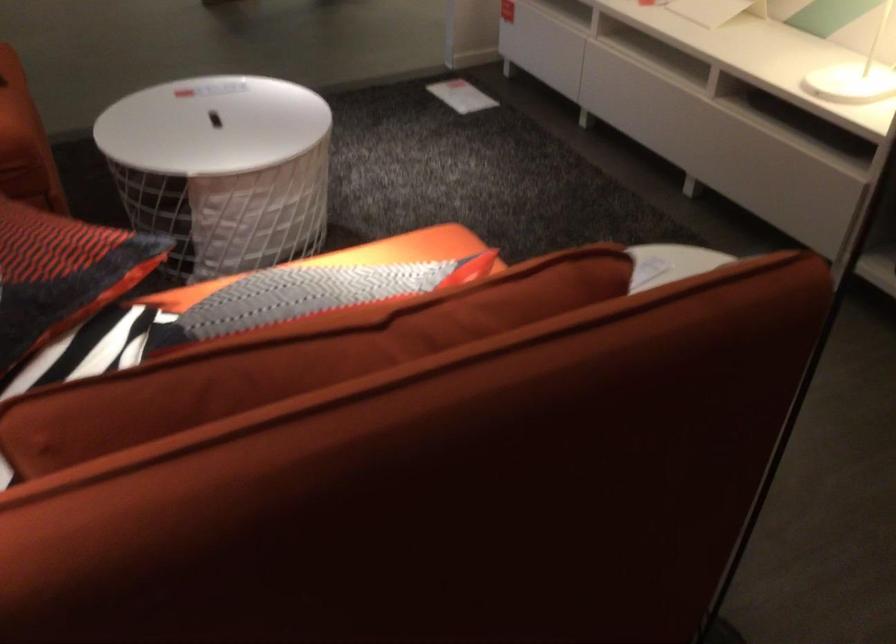
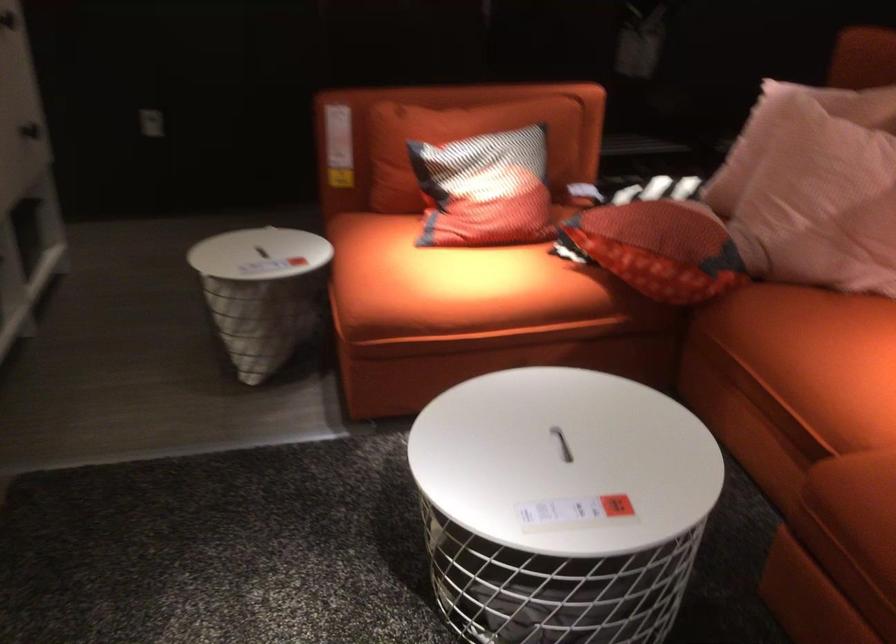
Locate, in the second image, the point that corresponds to the point at 340,256 in the first image.

(449, 281)